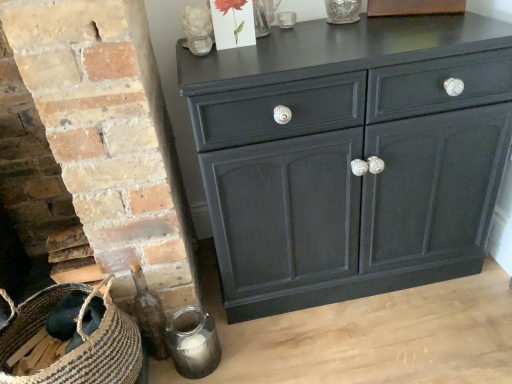
I want to click on free space in front of matte black cabinet at center, so click(376, 340).